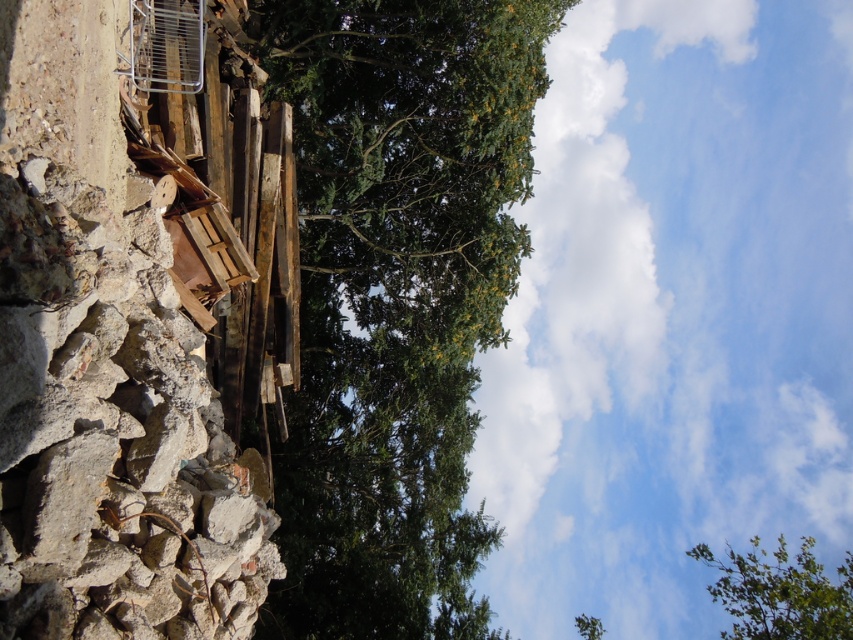
You are standing in a construction site and see the rough concrete cliff at left and the green leafy tree at upper center. Which object is closer to you?

The rough concrete cliff at left is closer to you because it is in front of the green leafy tree at upper center.